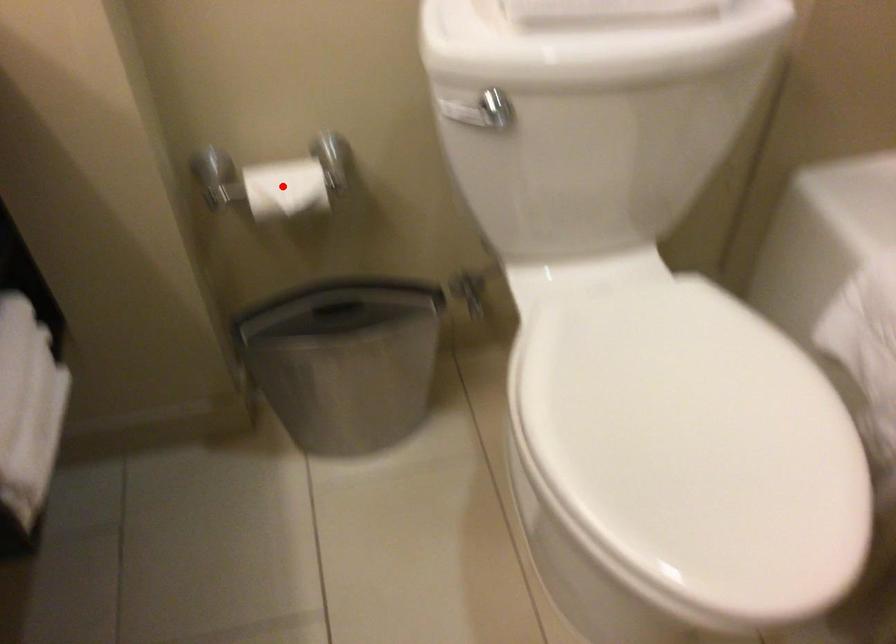
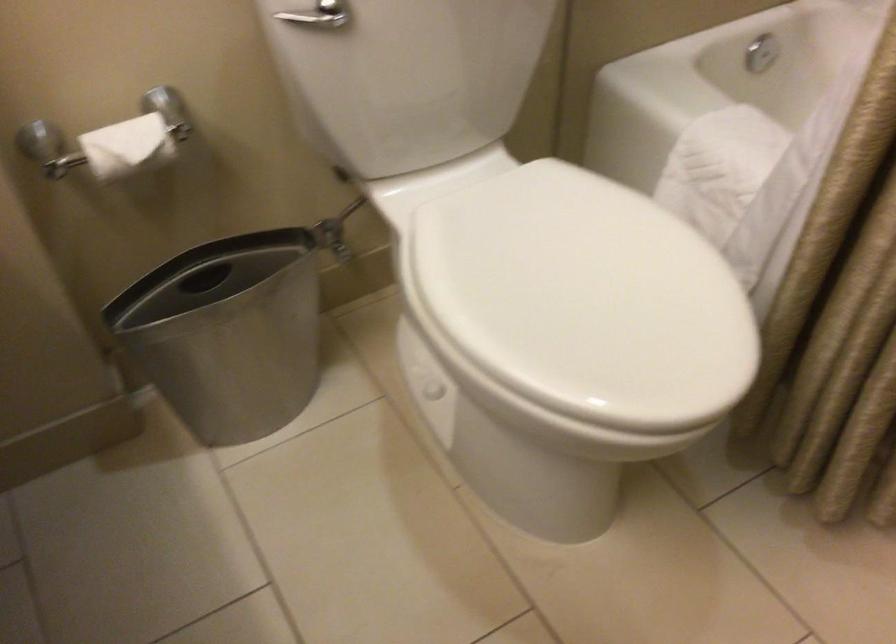
Find the pixel in the second image that matches the highlighted location in the first image.

(126, 146)